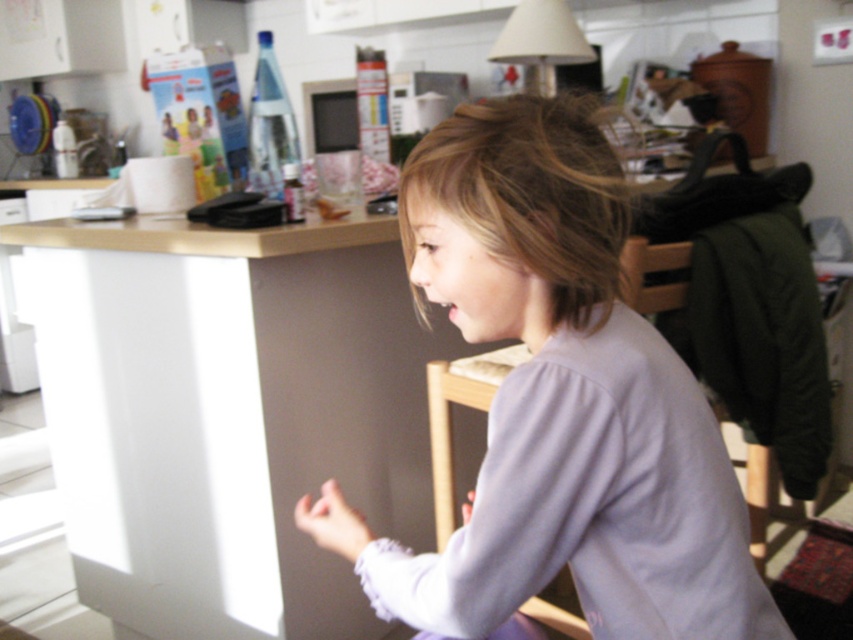
Locate an element on the screen. light purple fabric at center is located at coordinates (556, 404).

Identify the location of light purple fabric at center. coord(556,404).